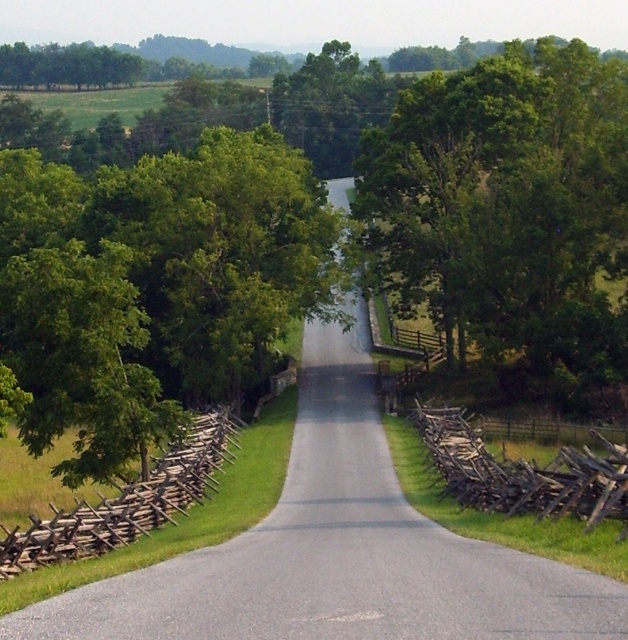
Who is lower down, green leafy tree at upper right or weathered wooden fence at right?

weathered wooden fence at right

Is point (573, 76) more distant than point (472, 451)?

Yes, it is.

Locate an element on the screen. green leafy tree at upper right is located at coordinates (507, 208).

Does green leafy tree at upper right have a greater width compared to brown wooden fence at left?

Indeed, green leafy tree at upper right has a greater width compared to brown wooden fence at left.

Does green leafy tree at upper right have a lesser height compared to brown wooden fence at left?

No.

Is point (539, 156) closer to viewer compared to point (40, 554)?

No, it is behind (40, 554).

At what (x,y) coordinates should I click in order to perform the action: click on green leafy tree at upper right. Please return your answer as a coordinate pair (x, y). The height and width of the screenshot is (640, 628). Looking at the image, I should click on (507, 208).

Looking at this image, can you confirm if green leafy tree at center is wider than gray asphalt road at center?

Yes.

Does green leafy tree at center have a lesser width compared to gray asphalt road at center?

In fact, green leafy tree at center might be wider than gray asphalt road at center.

Is point (290, 154) positioned in front of point (577, 611)?

No, it is behind (577, 611).

In order to click on green leafy tree at center in this screenshot , I will do [168, 292].